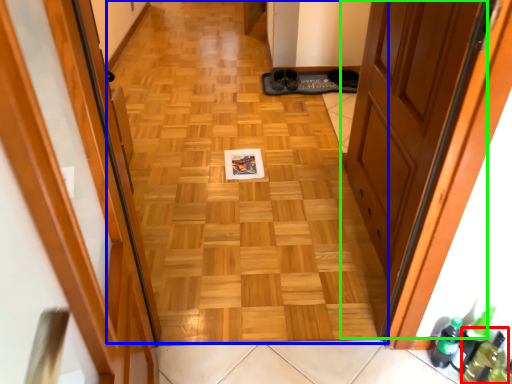
Question: Based on their relative distances, which object is nearer to bottle (highlighted by a red box)? Choose from plain (highlighted by a blue box) and door (highlighted by a green box).

Choices:
 (A) plain
 (B) door

Answer: (B)